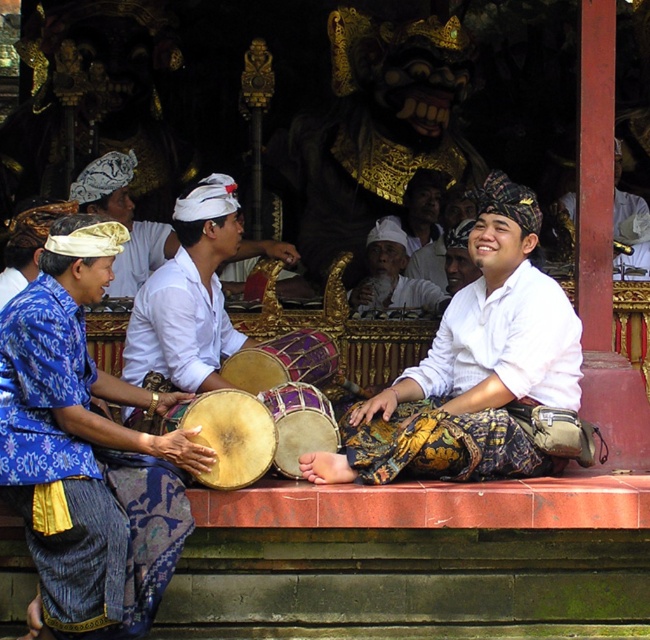
Is white cotton shirt at center to the right of white matte drum at center from the viewer's perspective?

Correct, you'll find white cotton shirt at center to the right of white matte drum at center.

How far apart are white cotton shirt at center and white matte drum at center?

white cotton shirt at center is 27.88 feet from white matte drum at center.

Describe the element at coordinates (473, 368) in the screenshot. I see `white cotton shirt at center` at that location.

Where is `white cotton shirt at center`? The image size is (650, 640). white cotton shirt at center is located at coordinates (473, 368).

Does blue batik shirt at left have a smaller size compared to purple wooden drum at center?

No.

Which is above, blue batik shirt at left or purple wooden drum at center?

blue batik shirt at left is higher up.

The width and height of the screenshot is (650, 640). I want to click on blue batik shirt at left, so click(x=86, y=451).

Is white cotton hat at center wider than purple wooden drum at center?

Indeed, white cotton hat at center has a greater width compared to purple wooden drum at center.

Does point (404, 266) come behind point (292, 476)?

Yes, point (404, 266) is farther from viewer.

The width and height of the screenshot is (650, 640). What are the coordinates of `white cotton hat at center` in the screenshot? It's located at (391, 275).